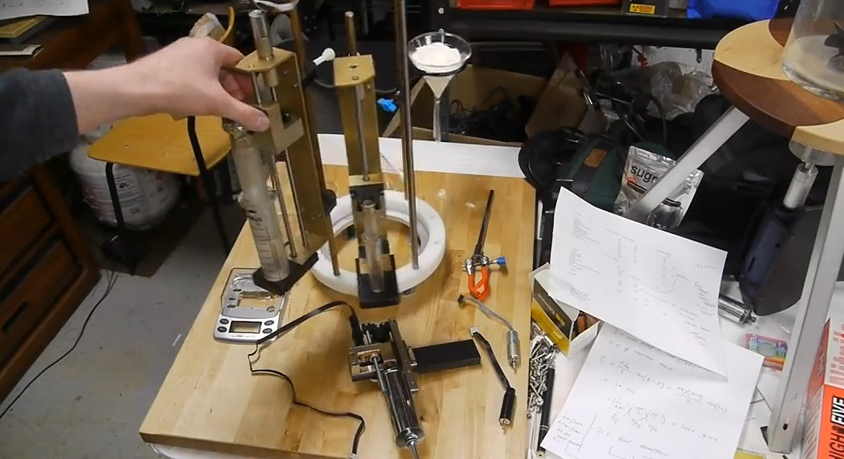
You are a GUI agent. You are given a task and a screenshot of the screen. Output one action in this format:
    pyautogui.click(x=<x>, y=<y>)
    Task: Click on the glass scale with silver on it
    This screenshot has width=844, height=459.
    Given the screenshot: What is the action you would take?
    click(x=233, y=306)